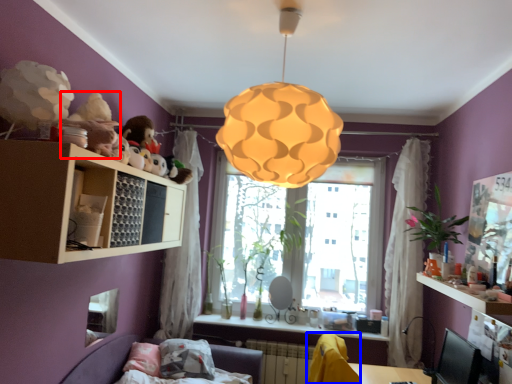
Question: Which object is closer to the camera taking this photo, toy (highlighted by a red box) or swivel chair (highlighted by a blue box)?

Choices:
 (A) toy
 (B) swivel chair

Answer: (A)